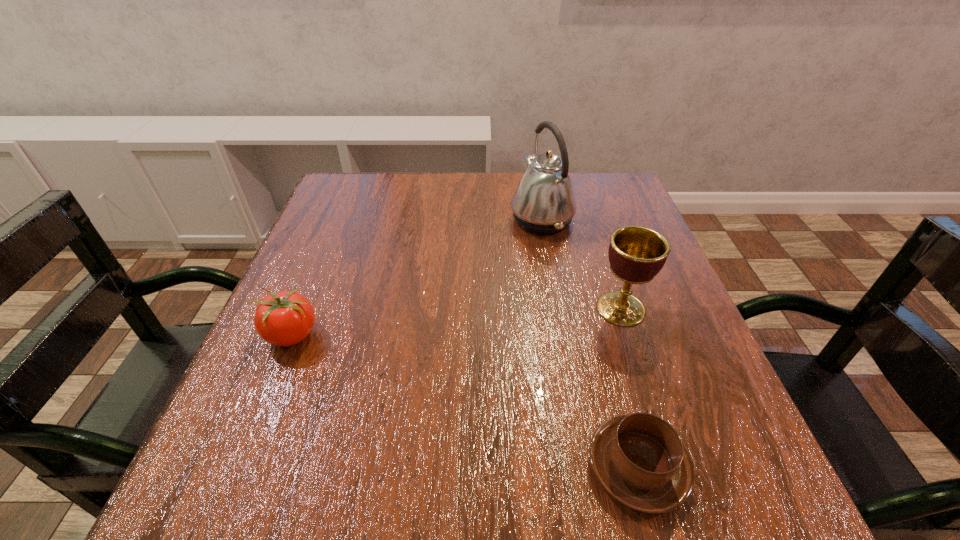
Locate an element on the screen. This screenshot has width=960, height=540. vacant space situated 0.380m on the side of the nearest object with the handle is located at coordinates (583, 263).

I want to click on free region located 0.360m on the side of the nearest object with the handle, so click(585, 269).

Find the location of a particular element. This screenshot has width=960, height=540. vacant region located 0.160m on the side of the nearest object with the handle is located at coordinates (604, 341).

Identify the location of object that is at the far edge. This screenshot has height=540, width=960. (544, 203).

You are a GUI agent. You are given a task and a screenshot of the screen. Output one action in this format:
    pyautogui.click(x=<x>, y=<y>)
    Task: Click on the object that is positioned at the near edge
    
    Given the screenshot: What is the action you would take?
    pyautogui.click(x=639, y=459)

Find the location of a particular element. Image resolution: width=960 pixels, height=540 pixels. object that is at the left edge is located at coordinates (286, 318).

Where is `chalice present at the right edge`? The image size is (960, 540). chalice present at the right edge is located at coordinates (636, 254).

Identify the location of cappuccino that is at the right edge. (639, 459).

In order to click on object present at the near right corner in this screenshot , I will do `click(639, 459)`.

In the image, there is a desktop. At what (x,y) coordinates should I click in order to perform the action: click on vacant space at the far edge. Please return your answer as a coordinate pair (x, y). The image size is (960, 540). Looking at the image, I should click on (408, 218).